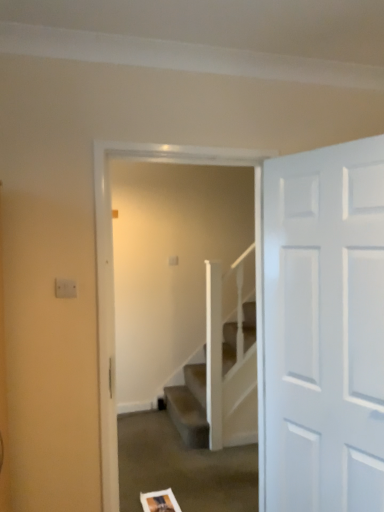
Question: Is carpeted stairs at center behind white painted wood door at right?

Choices:
 (A) no
 (B) yes

Answer: (B)

Question: Is white painted wood door at right inside carpeted stairs at center?

Choices:
 (A) yes
 (B) no

Answer: (B)

Question: From the image's perspective, is carpeted stairs at center beneath white painted wood door at right?

Choices:
 (A) yes
 (B) no

Answer: (A)

Question: Can you see carpeted stairs at center touching white painted wood door at right?

Choices:
 (A) yes
 (B) no

Answer: (B)

Question: Is carpeted stairs at center outside white painted wood door at right?

Choices:
 (A) no
 (B) yes

Answer: (B)

Question: Can you confirm if carpeted stairs at center is wider than white painted wood door at right?

Choices:
 (A) yes
 (B) no

Answer: (A)

Question: Could you tell me if white painted wood door at right is turned towards carpeted stairs at center?

Choices:
 (A) yes
 (B) no

Answer: (B)

Question: Is white painted wood door at right facing away from carpeted stairs at center?

Choices:
 (A) yes
 (B) no

Answer: (B)

Question: From the image's perspective, is white painted wood door at right above carpeted stairs at center?

Choices:
 (A) no
 (B) yes

Answer: (B)

Question: Is the depth of white painted wood door at right less than that of carpeted stairs at center?

Choices:
 (A) yes
 (B) no

Answer: (A)

Question: Is white painted wood door at right shorter than carpeted stairs at center?

Choices:
 (A) yes
 (B) no

Answer: (A)

Question: Is white painted wood door at right not within carpeted stairs at center?

Choices:
 (A) yes
 (B) no

Answer: (A)

Question: In terms of size, does white painted wood door at right appear bigger or smaller than carpeted stairs at center?

Choices:
 (A) small
 (B) big

Answer: (A)